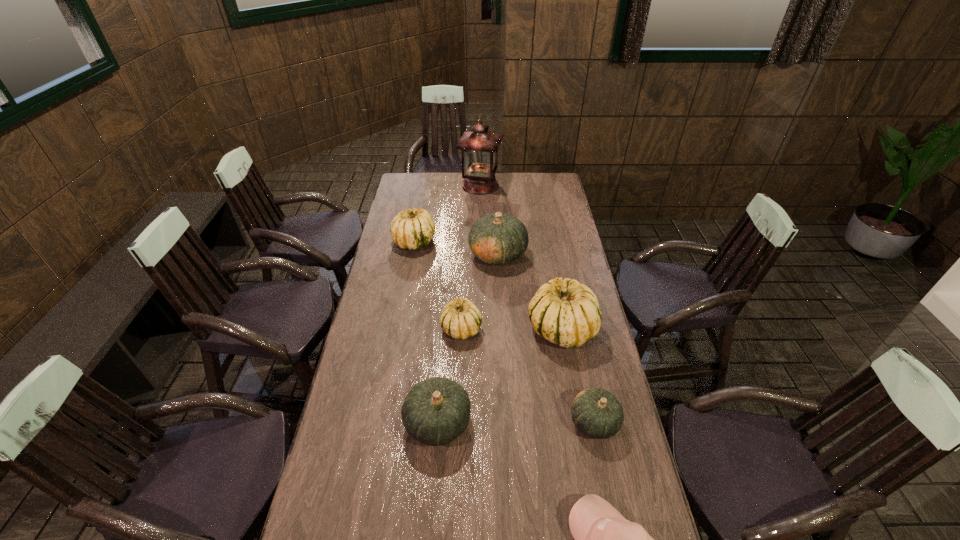
In order to click on vacant region at the far left corner in this screenshot , I will do `click(420, 186)`.

At what (x,y) coordinates should I click in order to perform the action: click on free spot between the farthest orange gourd and the second biggest orange gourd. Please return your answer as a coordinate pair (x, y). The width and height of the screenshot is (960, 540). Looking at the image, I should click on (468, 338).

At what (x,y) coordinates should I click in order to perform the action: click on empty location between the smallest white gourd and the leftmost white gourd. Please return your answer as a coordinate pair (x, y). This screenshot has height=540, width=960. Looking at the image, I should click on (438, 285).

Locate an element on the screen. empty space that is in between the second white gourd from left to right and the oil lamp is located at coordinates (470, 257).

Where is `free spot between the oil lamp and the farthest white gourd`? free spot between the oil lamp and the farthest white gourd is located at coordinates [447, 213].

Where is `free space between the rightmost orange gourd and the biggest white gourd`? Image resolution: width=960 pixels, height=540 pixels. free space between the rightmost orange gourd and the biggest white gourd is located at coordinates (578, 375).

At what (x,y) coordinates should I click in order to perform the action: click on the closest object to the oil lamp. Please return your answer as a coordinate pair (x, y). Looking at the image, I should click on (411, 229).

The image size is (960, 540). I want to click on object that is the second nearest to the smallest white gourd, so click(x=436, y=411).

Find the location of a particular element. gourd that is the fifth nearest to the farthest object is located at coordinates (436, 411).

Locate an element on the screen. Image resolution: width=960 pixels, height=540 pixels. gourd that is the fourth closest one to the farthest object is located at coordinates (461, 319).